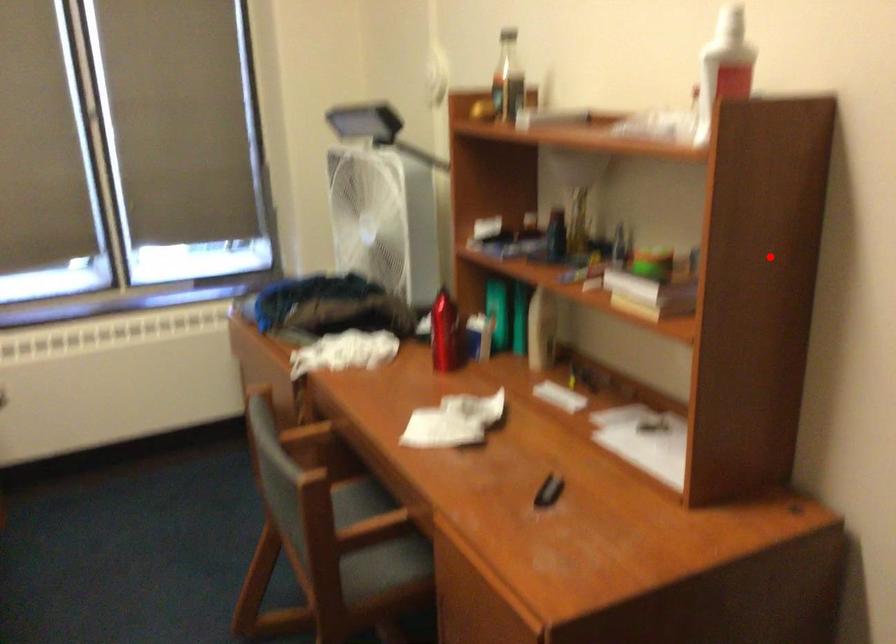
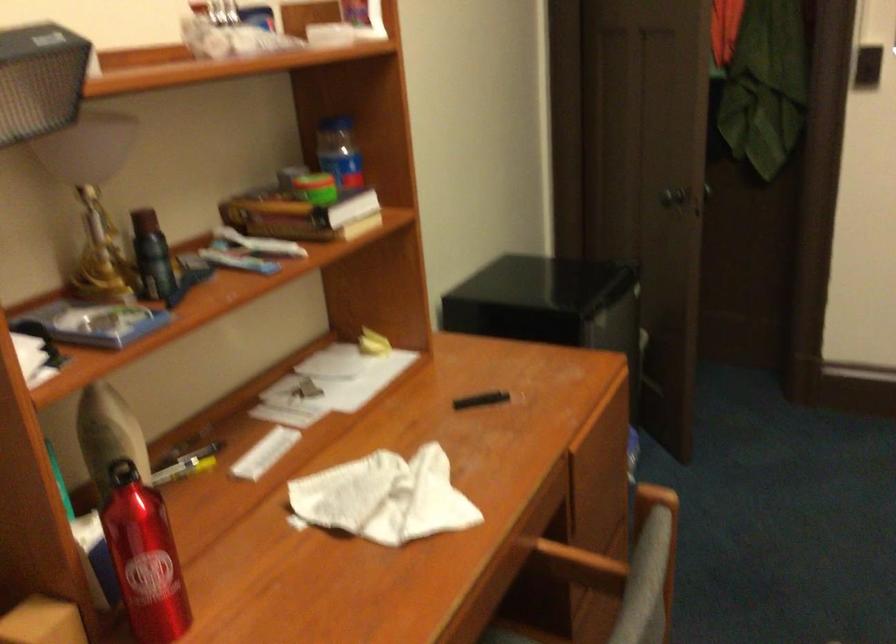
Question: I am providing you with two images of the same scene from different viewpoints. A red point is shown in image1. For the corresponding object point in image2, is it positioned nearer or farther from the camera?

Choices:
 (A) Nearer
 (B) Farther

Answer: (B)